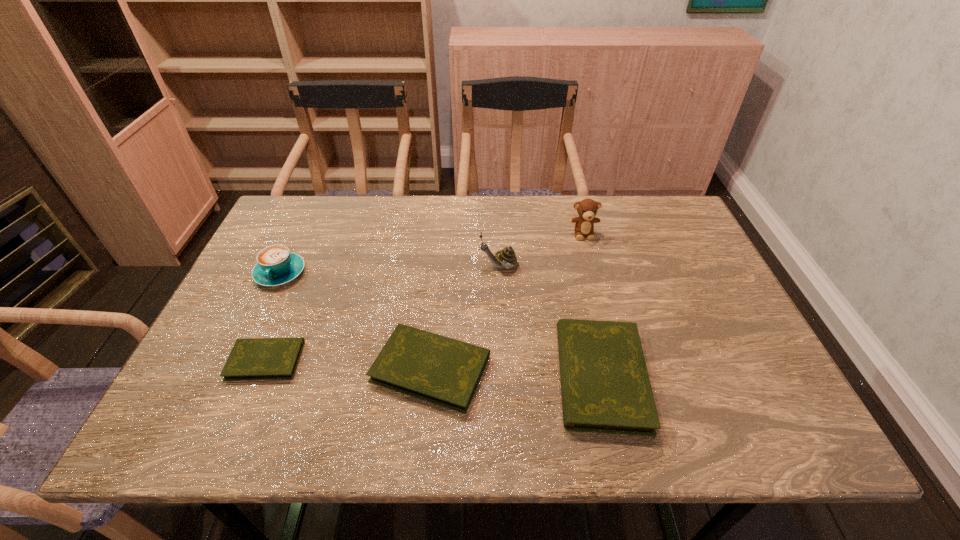
Where is `free space between the third tallest object and the second tallest diary`? Image resolution: width=960 pixels, height=540 pixels. free space between the third tallest object and the second tallest diary is located at coordinates (355, 321).

The width and height of the screenshot is (960, 540). I want to click on free space between the teddy bear and the snail, so click(541, 249).

You are a GUI agent. You are given a task and a screenshot of the screen. Output one action in this format:
    pyautogui.click(x=<x>, y=<y>)
    Task: Click on the vacant point located between the second diary from right to left and the snail
    
    Given the screenshot: What is the action you would take?
    pyautogui.click(x=465, y=317)

The width and height of the screenshot is (960, 540). What are the coordinates of `empty space that is in between the teddy bear and the snail` in the screenshot? It's located at (541, 249).

This screenshot has height=540, width=960. Find the location of `vacant area that lies between the snail and the shortest object`. vacant area that lies between the snail and the shortest object is located at coordinates (382, 313).

Where is `free space between the rightmost diary and the second shortest diary`? The height and width of the screenshot is (540, 960). free space between the rightmost diary and the second shortest diary is located at coordinates (516, 373).

Choose which object is the nearest neighbor to the rightmost diary. Please provide its 2D coordinates. Your answer should be formatted as a tuple, i.e. [(x, y)], where the tuple contains the x and y coordinates of a point satisfying the conditions above.

[(437, 369)]

Identify which object is located as the fourth nearest to the farthest object. Please provide its 2D coordinates. Your answer should be formatted as a tuple, i.e. [(x, y)], where the tuple contains the x and y coordinates of a point satisfying the conditions above.

[(276, 265)]

What are the coordinates of `diary identified as the second closest to the snail` in the screenshot? It's located at (605, 387).

At what (x,y) coordinates should I click in order to perform the action: click on diary that stands as the closest to the snail. Please return your answer as a coordinate pair (x, y). Image resolution: width=960 pixels, height=540 pixels. Looking at the image, I should click on (437, 369).